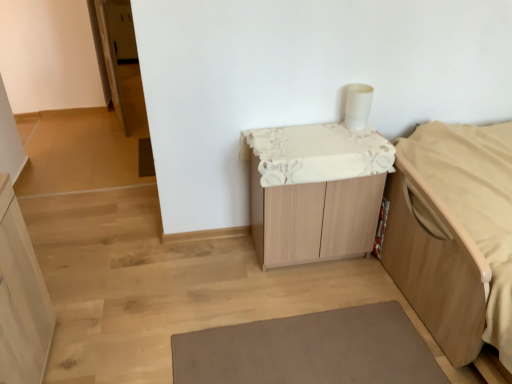
Where is `vacant area that is in front of wooden cabinet at center`? vacant area that is in front of wooden cabinet at center is located at coordinates (310, 294).